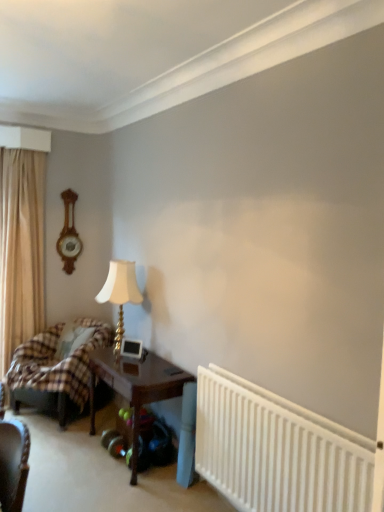
Question: Is wooden clock at left wider than wooden table at center?

Choices:
 (A) yes
 (B) no

Answer: (B)

Question: Does wooden clock at left have a lesser width compared to wooden table at center?

Choices:
 (A) yes
 (B) no

Answer: (A)

Question: From the image's perspective, is wooden clock at left above wooden table at center?

Choices:
 (A) no
 (B) yes

Answer: (B)

Question: Is wooden clock at left to the right of wooden table at center from the viewer's perspective?

Choices:
 (A) yes
 (B) no

Answer: (B)

Question: Is wooden table at center at the back of wooden clock at left?

Choices:
 (A) yes
 (B) no

Answer: (B)

Question: From the image's perspective, is plaid fabric bed at left above or below wooden clock at left?

Choices:
 (A) above
 (B) below

Answer: (B)

Question: Is plaid fabric bed at left inside the boundaries of wooden clock at left, or outside?

Choices:
 (A) inside
 (B) outside

Answer: (B)

Question: Is plaid fabric bed at left taller or shorter than wooden clock at left?

Choices:
 (A) tall
 (B) short

Answer: (B)

Question: Is plaid fabric bed at left bigger or smaller than wooden clock at left?

Choices:
 (A) big
 (B) small

Answer: (A)

Question: Looking at the image, does wooden table at center seem bigger or smaller compared to beige fabric curtain at left?

Choices:
 (A) small
 (B) big

Answer: (A)

Question: From the image's perspective, relative to beige fabric curtain at left, is wooden table at center above or below?

Choices:
 (A) above
 (B) below

Answer: (B)

Question: In the image, is wooden table at center positioned in front of or behind beige fabric curtain at left?

Choices:
 (A) behind
 (B) front

Answer: (B)

Question: Looking at their shapes, would you say wooden table at center is wider or thinner than beige fabric curtain at left?

Choices:
 (A) thin
 (B) wide

Answer: (B)

Question: In terms of size, does gold metallic table lamp at center-left appear bigger or smaller than plaid fabric bed at left?

Choices:
 (A) small
 (B) big

Answer: (A)

Question: In the image, is gold metallic table lamp at center-left positioned in front of or behind plaid fabric bed at left?

Choices:
 (A) behind
 (B) front

Answer: (B)